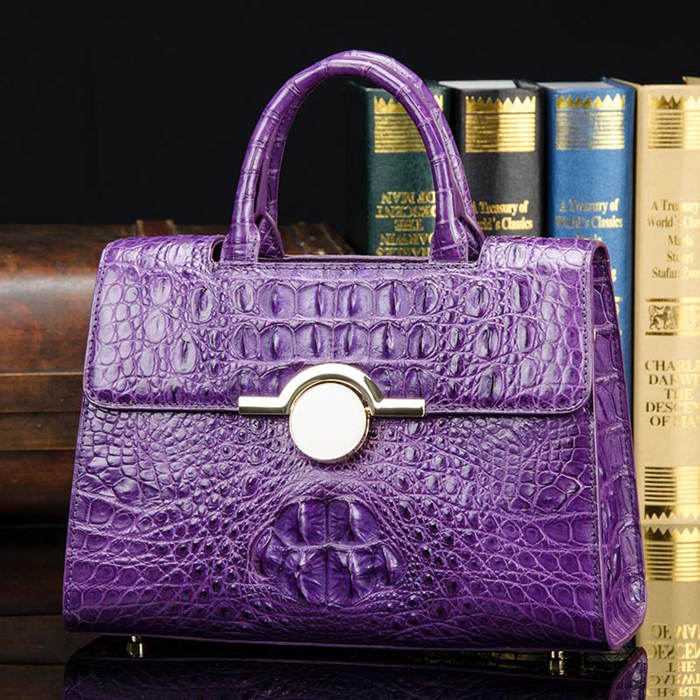
You are a GUI agent. You are given a task and a screenshot of the screen. Output one action in this format:
    pyautogui.click(x=<x>, y=<y>)
    Task: Click on the handle
    
    Given the screenshot: What is the action you would take?
    pyautogui.click(x=243, y=238), pyautogui.click(x=266, y=194)